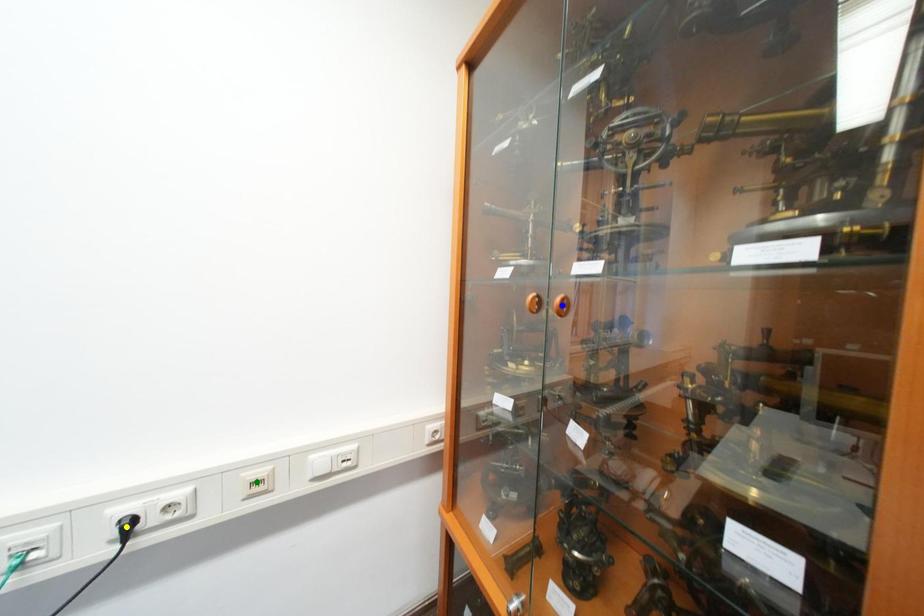
Order these from nearest to farthest:
blue point | green point | yellow point

1. blue point
2. yellow point
3. green point